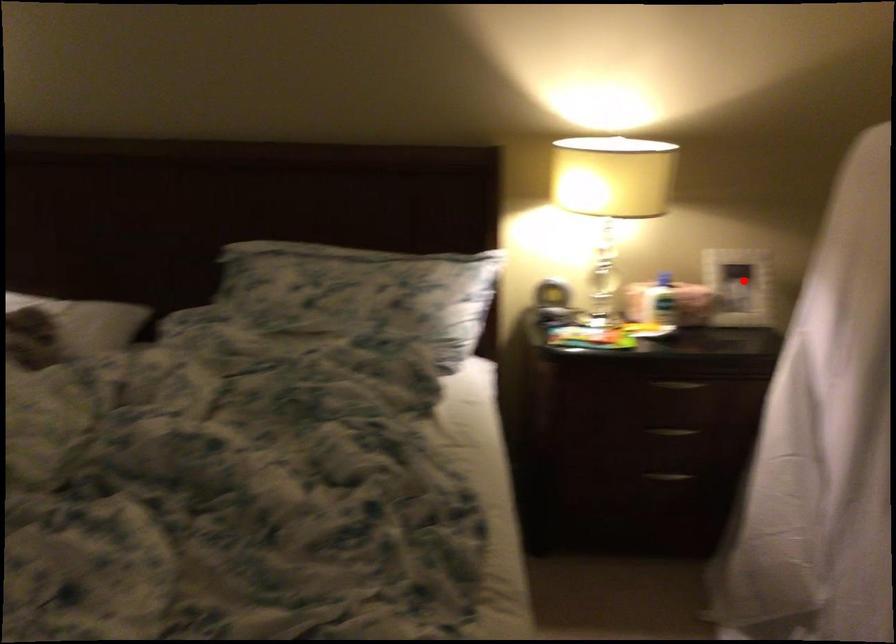
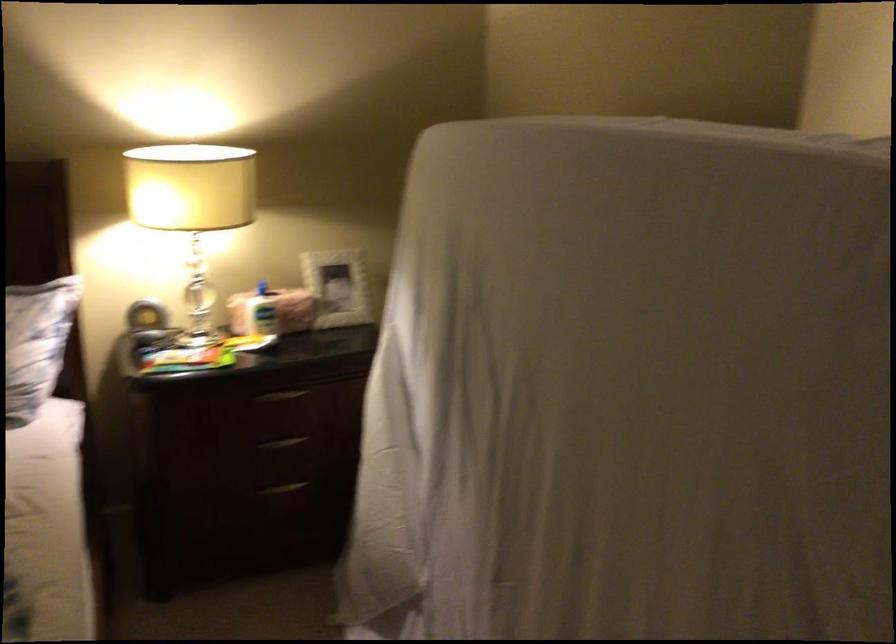
The point at the highlighted location is marked in the first image. Where is the corresponding point in the second image?

(337, 287)